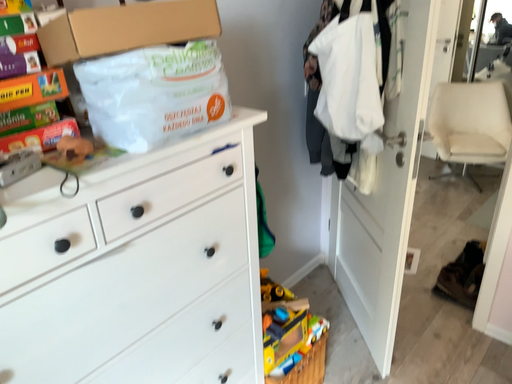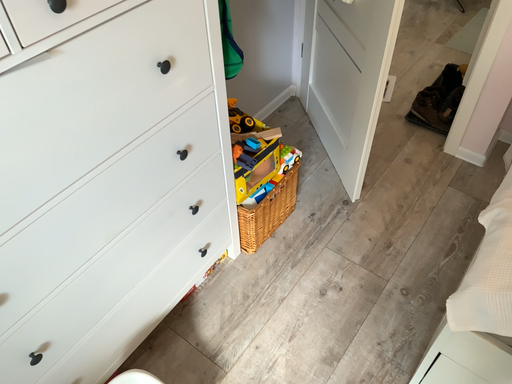
Question: Which way did the camera rotate in the video?

Choices:
 (A) rotated downward
 (B) rotated upward

Answer: (A)